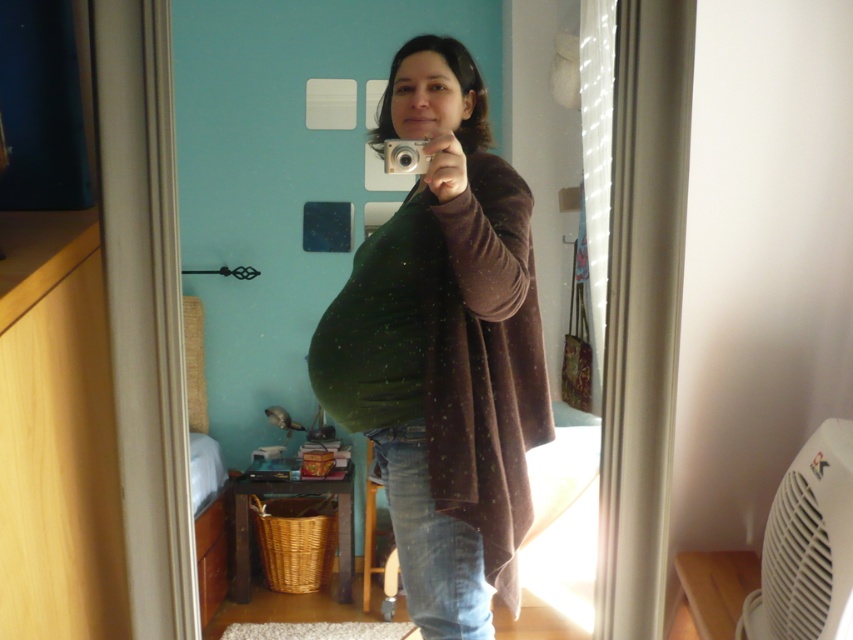
You are organizing the items on the desk in the bedroom scene. You need to place a new item between the green fabric pillow at center and the green fuzzy blanket at center. Which item should be placed closer to you?

The green fabric pillow at center should be placed closer to you because it is further to the viewer than the green fuzzy blanket at center, so it is already nearer.

You are organizing the items on the desk in the bedroom scene. You need to place both the green fabric pillow at center and the green fuzzy blanket at center on the desk. Which item should you place first to ensure they both fit?

Result: The green fabric pillow at center has a larger width than the green fuzzy blanket at center, so you should place the green fabric pillow at center first to accommodate its size before placing the green fuzzy blanket at center.

You are organizing the items on the desk in the bedroom scene. You need to place a new decorative item between the green fabric pillow at center and the green fuzzy blanket at center. Is there enough vertical space between them to fit a 5 cm tall object?

The green fabric pillow at center is above the green fuzzy blanket at center, so there is vertical space between them. Since the object is only 5 cm tall, it can fit between them.